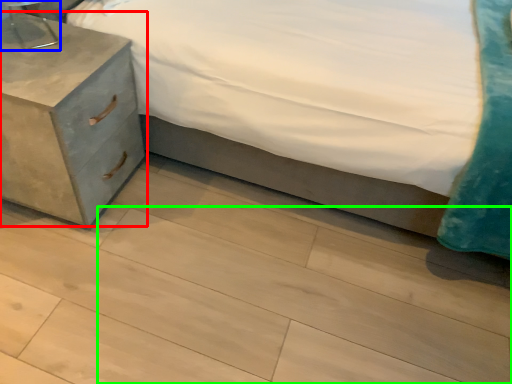
Question: Based on their relative distances, which object is farther from nightstand (highlighted by a red box)? Choose from table lamp (highlighted by a blue box) and tile (highlighted by a green box).

Choices:
 (A) table lamp
 (B) tile

Answer: (B)